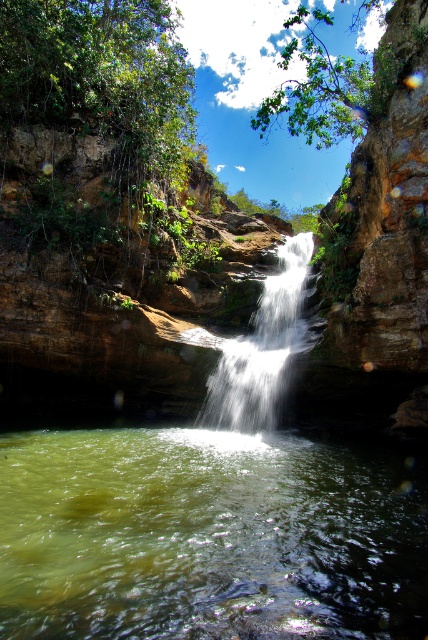
Does green translucent water at center come behind white silky waterfall at center?

No, it is in front of white silky waterfall at center.

This screenshot has height=640, width=428. Describe the element at coordinates (208, 538) in the screenshot. I see `green translucent water at center` at that location.

Which is behind, point (134, 630) or point (243, 372)?

The point (243, 372) is behind.

Where is `green translucent water at center`? The width and height of the screenshot is (428, 640). green translucent water at center is located at coordinates (208, 538).